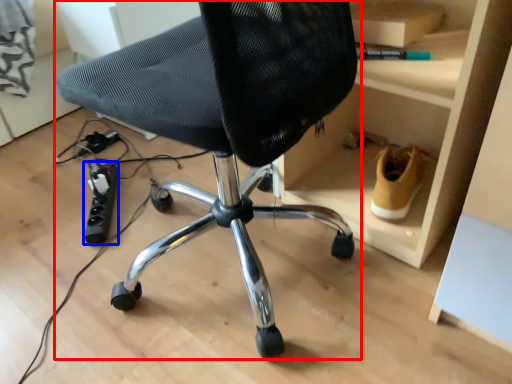
Question: Among these objects, which one is nearest to the camera, chair (highlighted by a red box) or plug (highlighted by a blue box)?

Choices:
 (A) chair
 (B) plug

Answer: (A)